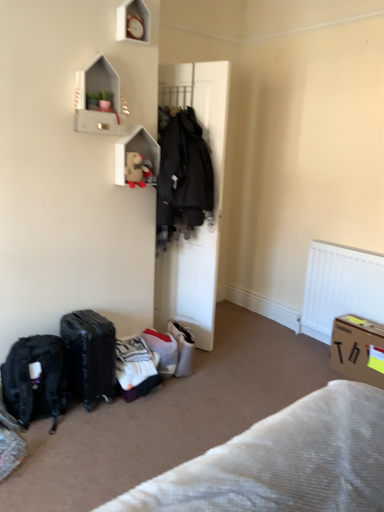
At what (x,y) coordinates should I click in order to perform the action: click on vacant space to the right of black matte suitcase at lower left. Please return your answer as a coordinate pair (x, y). This screenshot has height=512, width=384. Looking at the image, I should click on (125, 411).